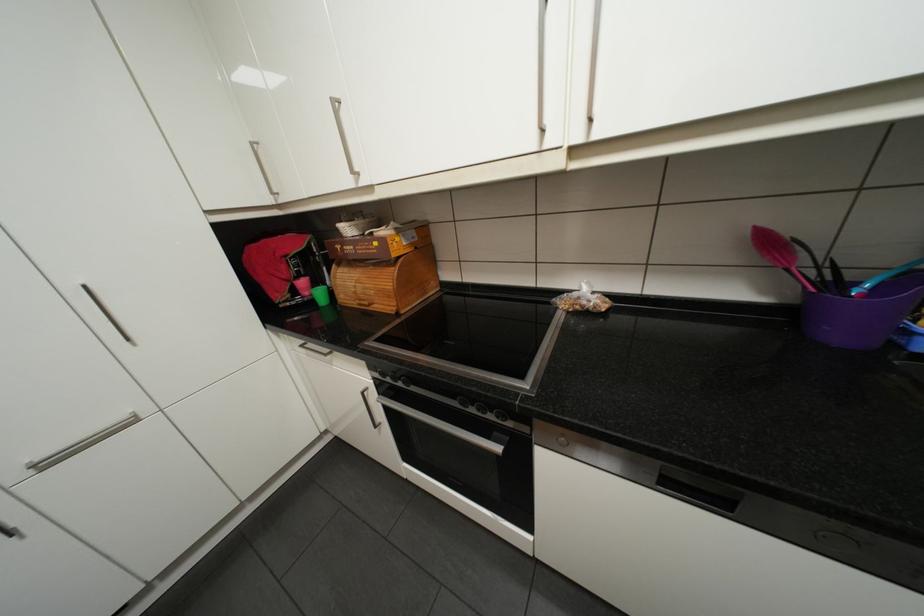
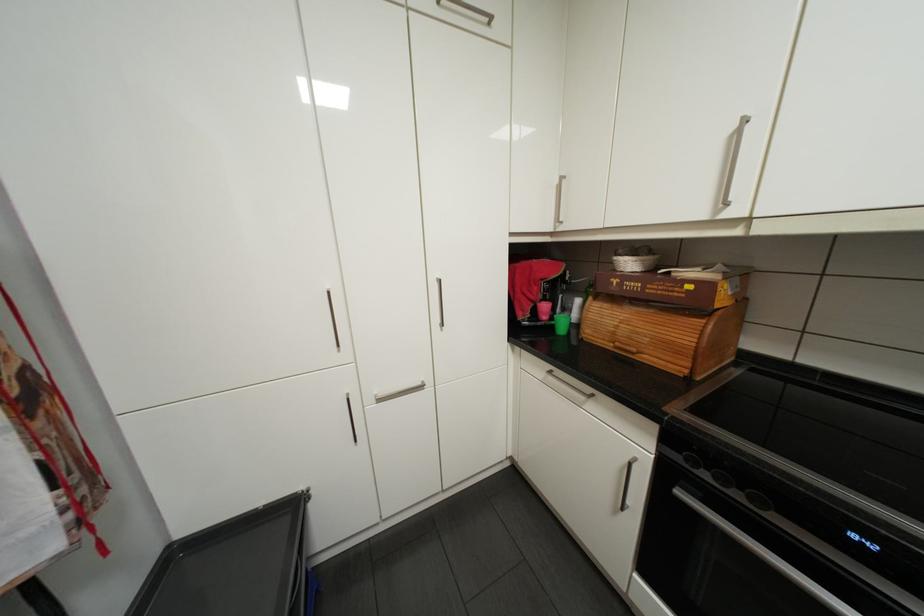
Question: The camera is either moving clockwise (left) or counter-clockwise (right) around the object. The first image is from the beginning of the video and the second image is from the end. Is the camera moving left or right when shooting the video?

Choices:
 (A) Left
 (B) Right

Answer: (B)